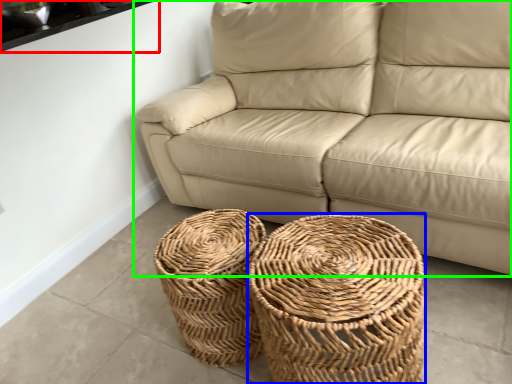
Question: Which object is the farthest from window sill (highlighted by a red box)? Choose among these: basket (highlighted by a blue box) or studio couch (highlighted by a green box).

Choices:
 (A) basket
 (B) studio couch

Answer: (A)